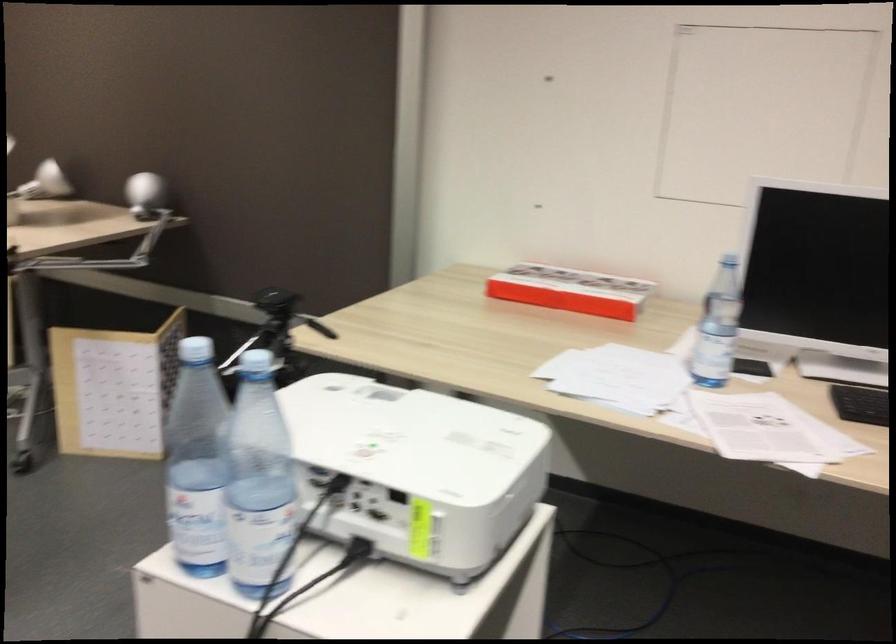
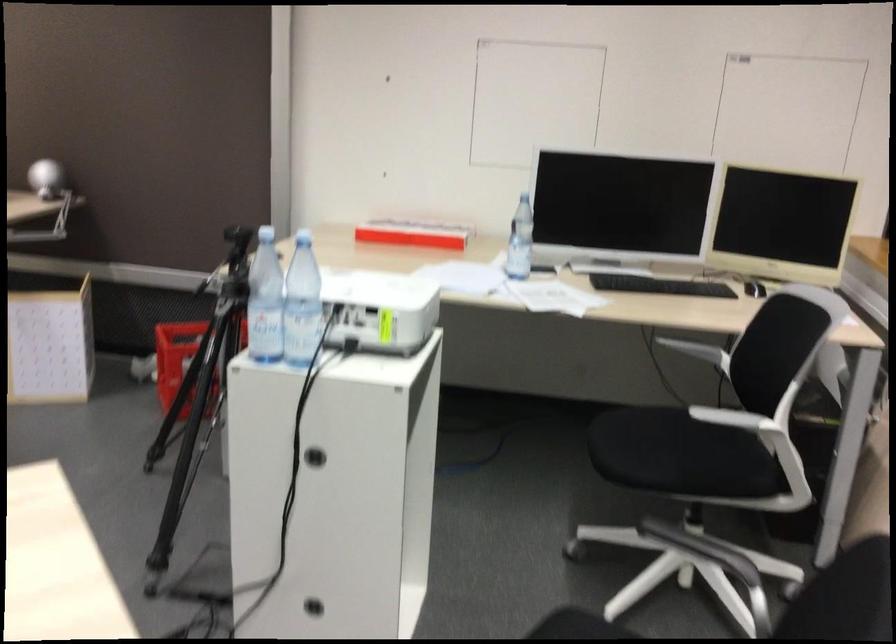
The point at (565, 292) is marked in the first image. Where is the corresponding point in the second image?

(412, 234)